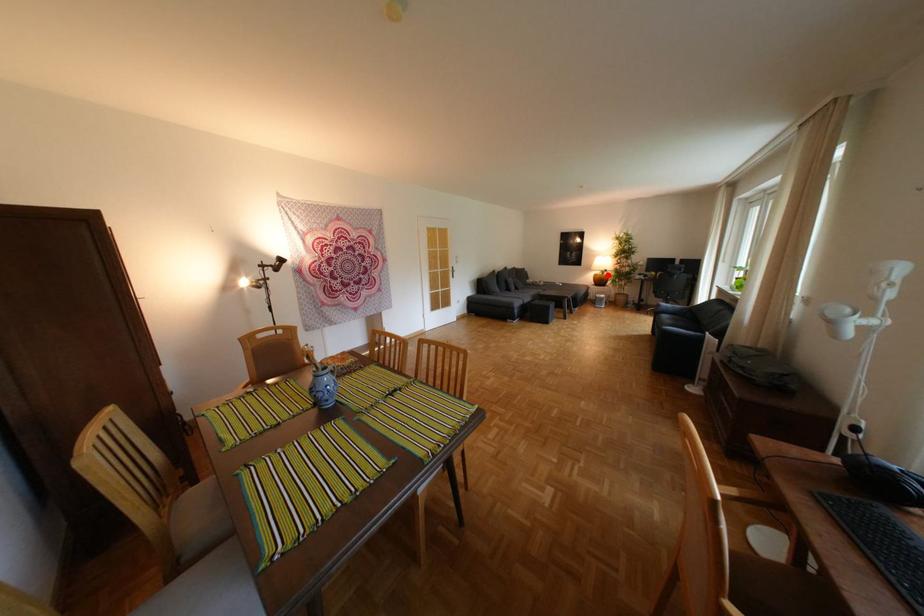
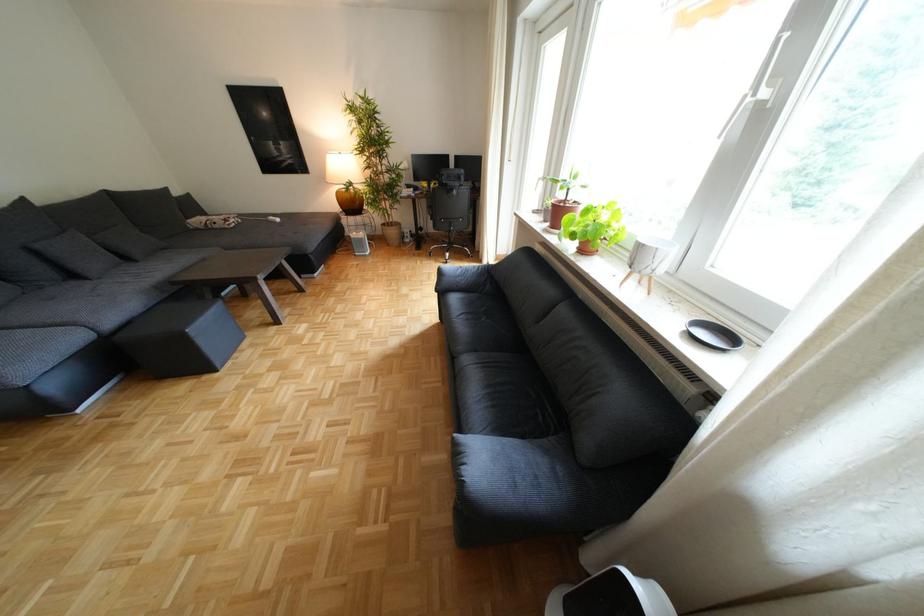
Question: I am providing you with two images of the same scene from different viewpoints. A red point is marked on the first image. At the location where the point appears in image 1, is it still visible in image 2?

Choices:
 (A) Yes
 (B) No

Answer: (A)